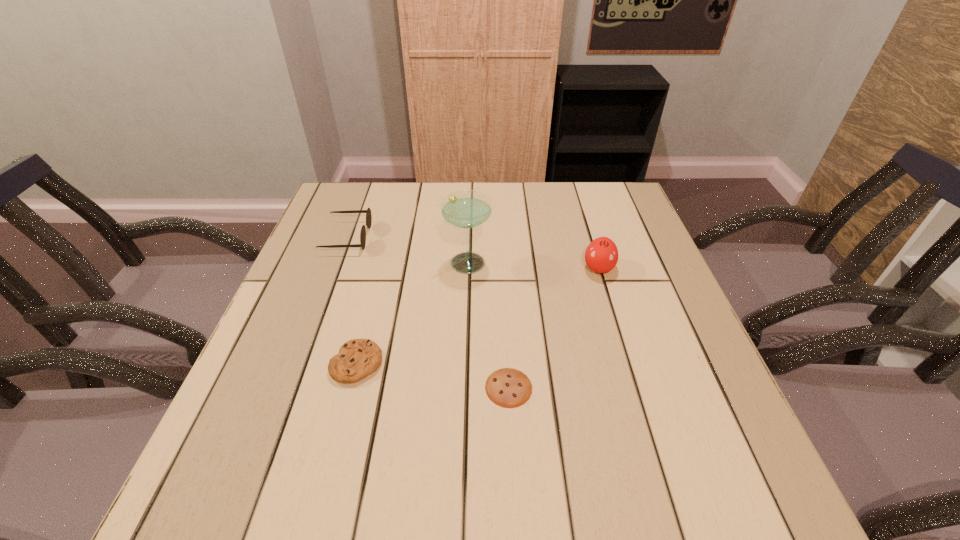
This screenshot has height=540, width=960. I want to click on martini, so click(465, 209).

You are a GUI agent. You are given a task and a screenshot of the screen. Output one action in this format:
    pyautogui.click(x=<x>, y=<y>)
    Task: Click on the apple
    The image size is (960, 540).
    Given the screenshot: What is the action you would take?
    pyautogui.click(x=601, y=256)

Locate an element on the screen. The width and height of the screenshot is (960, 540). the rightmost object is located at coordinates (601, 256).

At what (x,y) coordinates should I click in order to perform the action: click on the third tallest object. Please return your answer as a coordinate pair (x, y). Image resolution: width=960 pixels, height=540 pixels. Looking at the image, I should click on (368, 212).

What are the coordinates of `sunglasses` in the screenshot? It's located at (368, 212).

Where is `the fourth tallest object`? The height and width of the screenshot is (540, 960). the fourth tallest object is located at coordinates (357, 358).

The height and width of the screenshot is (540, 960). I want to click on the left cookie, so click(x=357, y=358).

Locate an element on the screen. the shorter cookie is located at coordinates (507, 387).

Where is `the shortest object`? The width and height of the screenshot is (960, 540). the shortest object is located at coordinates (507, 387).

Where is `vacant space situated 0.270m on the back of the tallest object`? vacant space situated 0.270m on the back of the tallest object is located at coordinates (468, 193).